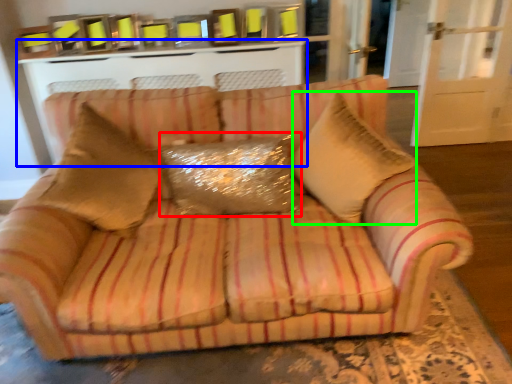
Question: Which object is the closest to the pillow (highlighted by a red box)? Choose among these: table (highlighted by a blue box) or throw pillow (highlighted by a green box).

Choices:
 (A) table
 (B) throw pillow

Answer: (B)